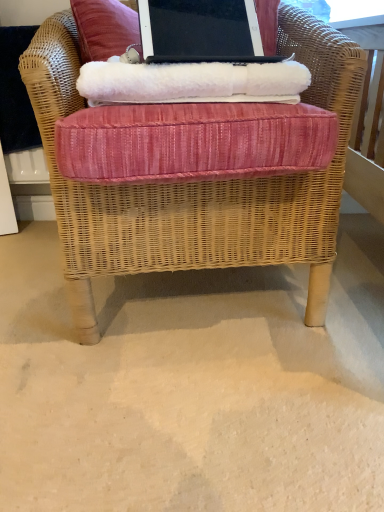
This screenshot has height=512, width=384. What do you see at coordinates (201, 32) in the screenshot? I see `black matte laptop at upper center` at bounding box center [201, 32].

Locate an element on the screen. The width and height of the screenshot is (384, 512). woven wicker chair at center is located at coordinates (195, 186).

From a real-world perspective, is black matte laptop at upper center above or below woven wicker chair at center?

From a real-world perspective, black matte laptop at upper center is physically above woven wicker chair at center.

Which object is further away from the camera, black matte laptop at upper center or woven wicker chair at center?

black matte laptop at upper center is further away from the camera.

Locate an element on the screen. Image resolution: width=384 pixels, height=512 pixels. laptop lying behind the woven wicker chair at center is located at coordinates (201, 32).

Find the location of `laptop on the right of woven wicker chair at center`. laptop on the right of woven wicker chair at center is located at coordinates (201, 32).

Is woven wicker chair at center facing towards black matte laptop at upper center?

Yes, woven wicker chair at center faces towards black matte laptop at upper center.

From a real-world perspective, which object stands above the other?

Answer: black matte laptop at upper center is physically above.

Which object is more forward, woven wicker chair at center or black matte laptop at upper center?

woven wicker chair at center is in front.

Which is correct: white fluffy blanket at upper center is inside woven wicker chair at center, or outside of it?

white fluffy blanket at upper center can be found inside woven wicker chair at center.

Who is bigger, white fluffy blanket at upper center or woven wicker chair at center?

Bigger between the two is woven wicker chair at center.

From a real-world perspective, who is located higher, white fluffy blanket at upper center or woven wicker chair at center?

white fluffy blanket at upper center.

In the image, is black matte laptop at upper center positioned in front of or behind white fluffy blanket at upper center?

black matte laptop at upper center is positioned closer to the viewer than white fluffy blanket at upper center.

Which is correct: black matte laptop at upper center is inside white fluffy blanket at upper center, or outside of it?

black matte laptop at upper center cannot be found inside white fluffy blanket at upper center.

From the image's perspective, is black matte laptop at upper center below white fluffy blanket at upper center?

No, from the image's perspective, black matte laptop at upper center is not beneath white fluffy blanket at upper center.

Is woven wicker chair at center located outside white fluffy blanket at upper center?

Yes, woven wicker chair at center is not within white fluffy blanket at upper center.

How much distance is there between woven wicker chair at center and white fluffy blanket at upper center?

They are 20.46 centimeters apart.

From the picture: How many degrees apart are the facing directions of woven wicker chair at center and white fluffy blanket at upper center?

The angle between the facing direction of woven wicker chair at center and the facing direction of white fluffy blanket at upper center is 5.04 degrees.

At what (x,y) coordinates should I click in order to perform the action: click on material that is behind the woven wicker chair at center. Please return your answer as a coordinate pair (x, y). Image resolution: width=384 pixels, height=512 pixels. Looking at the image, I should click on (191, 82).

Is white fluffy blanket at upper center beside black matte laptop at upper center?

white fluffy blanket at upper center and black matte laptop at upper center are not in contact.

Consider the image. Could you tell me if white fluffy blanket at upper center is facing black matte laptop at upper center?

No, white fluffy blanket at upper center is not turned towards black matte laptop at upper center.

Which of these two, white fluffy blanket at upper center or black matte laptop at upper center, is smaller?

black matte laptop at upper center.

Considering the relative sizes of white fluffy blanket at upper center and black matte laptop at upper center in the image provided, is white fluffy blanket at upper center thinner than black matte laptop at upper center?

No.

You are a GUI agent. You are given a task and a screenshot of the screen. Output one action in this format:
    pyautogui.click(x=<x>, y=<y>)
    Task: Click on the chair on the left of black matte laptop at upper center
    This screenshot has width=384, height=512.
    Given the screenshot: What is the action you would take?
    pyautogui.click(x=195, y=186)

This screenshot has height=512, width=384. Find the location of `laptop above the woven wicker chair at center (from a real-world perspective)`. laptop above the woven wicker chair at center (from a real-world perspective) is located at coordinates (201, 32).

When comparing their distances from black matte laptop at upper center, does white fluffy blanket at upper center or woven wicker chair at center seem closer?

woven wicker chair at center lies closer to black matte laptop at upper center than the other object.

Looking at the image, which one is located closer to black matte laptop at upper center, woven wicker chair at center or white fluffy blanket at upper center?

Among the two, woven wicker chair at center is located nearer to black matte laptop at upper center.

From the image, which object appears to be farther from white fluffy blanket at upper center, woven wicker chair at center or black matte laptop at upper center?

black matte laptop at upper center.

Which object lies further to the anchor point woven wicker chair at center, white fluffy blanket at upper center or black matte laptop at upper center?

The object further to woven wicker chair at center is black matte laptop at upper center.

Which object lies further to the anchor point woven wicker chair at center, black matte laptop at upper center or white fluffy blanket at upper center?

black matte laptop at upper center lies further to woven wicker chair at center than the other object.

Based on their spatial positions, is black matte laptop at upper center or woven wicker chair at center closer to white fluffy blanket at upper center?

woven wicker chair at center.

In order to click on laptop between woven wicker chair at center and white fluffy blanket at upper center in the front-back direction in this screenshot , I will do `click(201, 32)`.